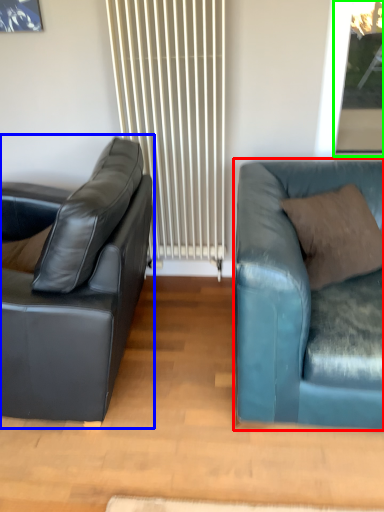
Question: Which object is positioned farthest from studio couch (highlighted by a red box)? Select from studio couch (highlighted by a blue box) and window screen (highlighted by a green box).

Choices:
 (A) studio couch
 (B) window screen

Answer: (B)